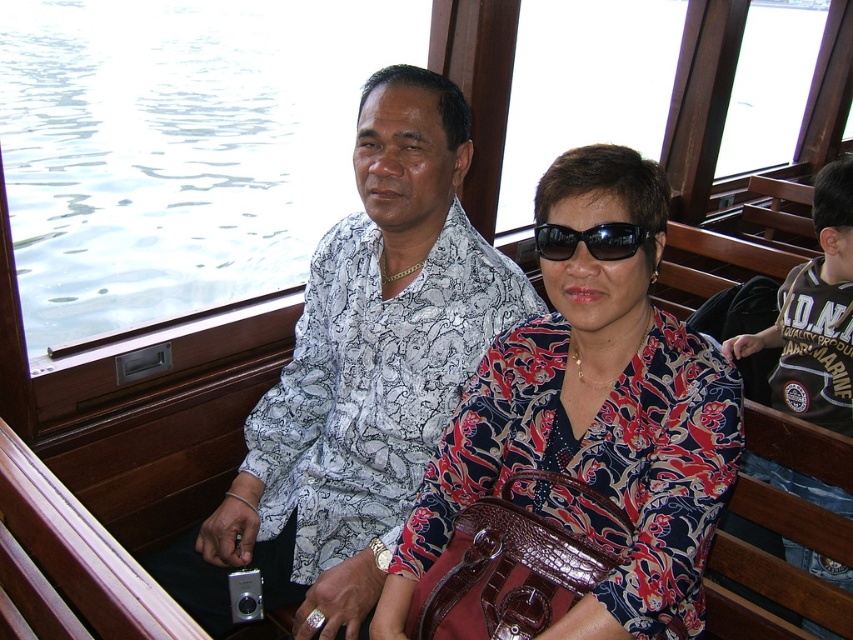
You are a photographer trying to capture a candid shot of the two people inside the boat. You notice the white printed shirt at center and the silver metallic camera at lower left. Which object is positioned higher in the scene?

The white printed shirt at center is located above the silver metallic camera at lower left, so the white printed shirt at center is positioned higher in the scene.

What are the coordinates of the silver metallic camera at lower left?

The silver metallic camera at lower left is located at coordinates point (193, 582).